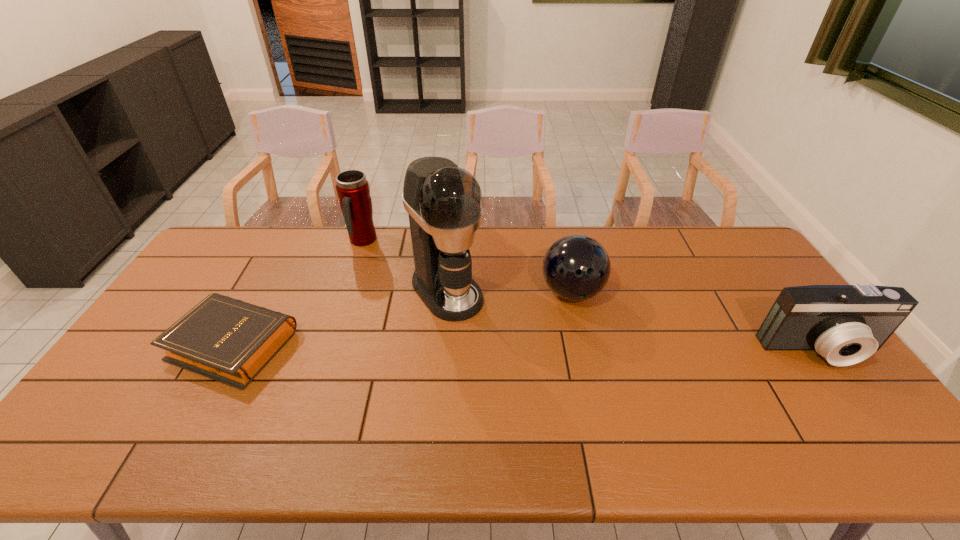
Find the location of `the leftmost object`. the leftmost object is located at coordinates [228, 340].

Find the location of a particular element. Bible is located at coordinates (228, 340).

Locate an element on the screen. the rightmost object is located at coordinates (845, 324).

Locate an element on the screen. coffee maker is located at coordinates (444, 202).

You are a GUI agent. You are given a task and a screenshot of the screen. Output one action in this format:
    pyautogui.click(x=<x>, y=<y>)
    Task: Click on the tallest object
    The width and height of the screenshot is (960, 540).
    Given the screenshot: What is the action you would take?
    tap(444, 202)

What are the coordinates of `the fourth object from left to right` in the screenshot? It's located at (576, 267).

Where is `the farthest object`? The height and width of the screenshot is (540, 960). the farthest object is located at coordinates (352, 188).

Find the location of a particular element. This screenshot has width=960, height=540. the second object from left to right is located at coordinates (352, 188).

The image size is (960, 540). Identify the location of free space located on the right of the Bible. (351, 344).

This screenshot has height=540, width=960. Identify the location of vacant space located 0.070m on the lens of the camcorder. (853, 394).